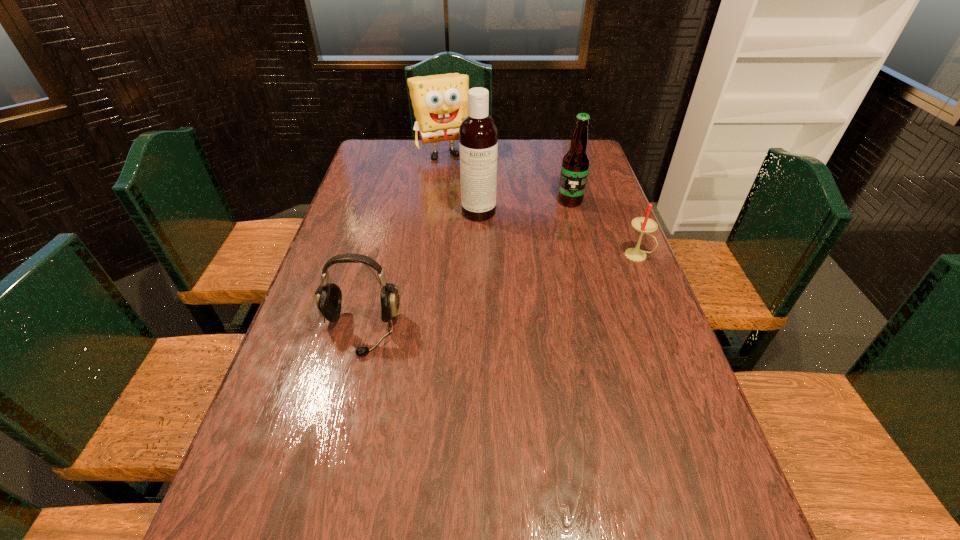
Find the location of a particular element. This screenshot has height=540, width=960. vacant space located on the face of the sponge is located at coordinates (474, 204).

Identify the location of vacant area situated 0.050m on the label of the beer bottle. (564, 216).

This screenshot has height=540, width=960. Find the location of `vacant space located 0.260m on the label of the beer bottle`. vacant space located 0.260m on the label of the beer bottle is located at coordinates (549, 255).

Identify the location of free space located on the label of the beer bottle. coord(540,279).

This screenshot has height=540, width=960. I want to click on free point located 0.080m on the label side of the dishwasher detergent, so click(485, 237).

Where is `free point located on the label side of the dishwasher detergent`? The height and width of the screenshot is (540, 960). free point located on the label side of the dishwasher detergent is located at coordinates (494, 281).

Where is `free space located 0.210m on the label side of the dishwasher detergent`? The image size is (960, 540). free space located 0.210m on the label side of the dishwasher detergent is located at coordinates (491, 265).

At what (x,y) coordinates should I click in order to perform the action: click on object present at the far edge. Please return your answer as a coordinate pair (x, y). The height and width of the screenshot is (540, 960). Looking at the image, I should click on (440, 102).

Identify the location of object located at the left edge. The image size is (960, 540). (328, 296).

Find the location of a particular element. The height and width of the screenshot is (540, 960). candle positioned at the right edge is located at coordinates (643, 225).